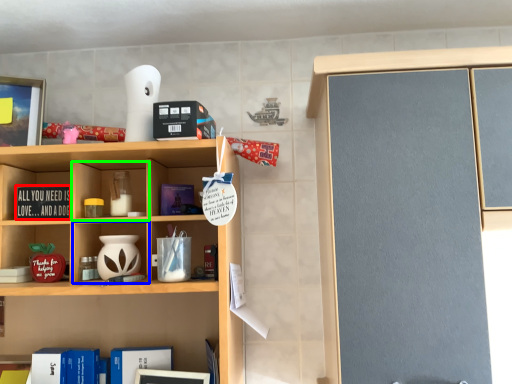
Question: Which is farther away from book (highlighted by a red box)? cabinet (highlighted by a blue box) or cabinet (highlighted by a green box)?

Choices:
 (A) cabinet
 (B) cabinet

Answer: (A)